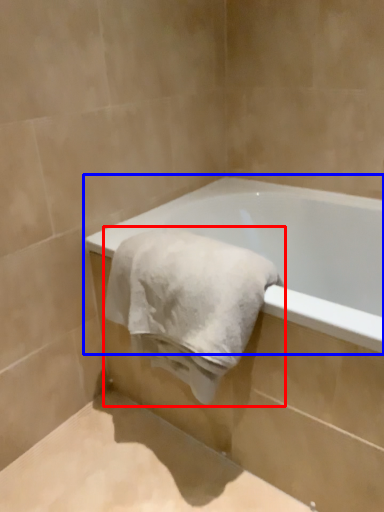
Question: Which point is further to the camera, towel (highlighted by a red box) or bathtub (highlighted by a blue box)?

Choices:
 (A) towel
 (B) bathtub

Answer: (A)